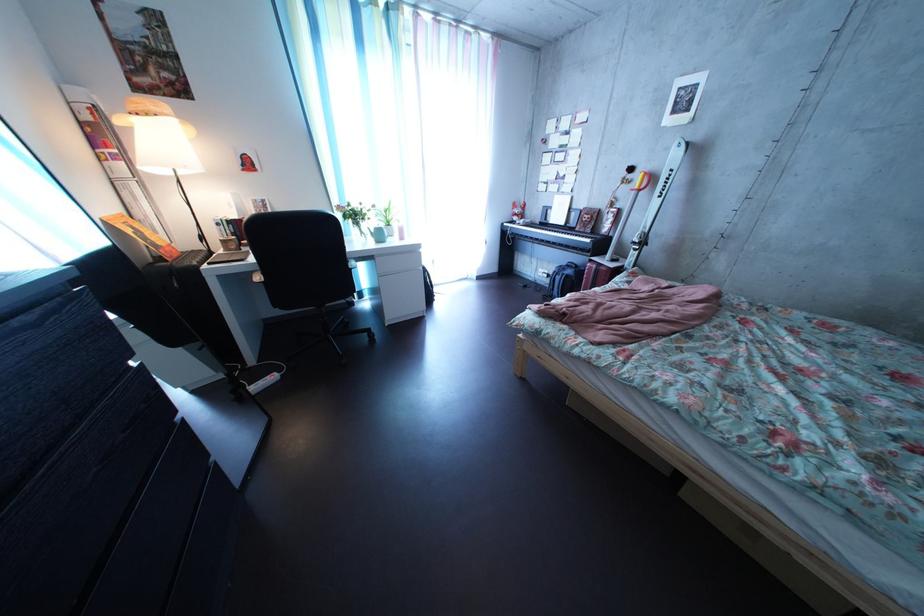
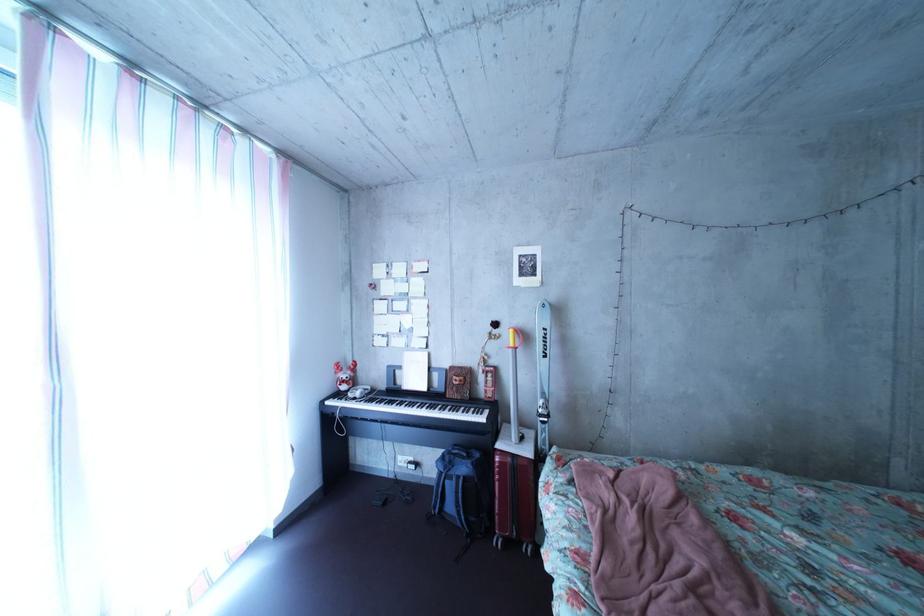
Find the pixel in the second image that matches [529,227] in the first image.

(358, 395)